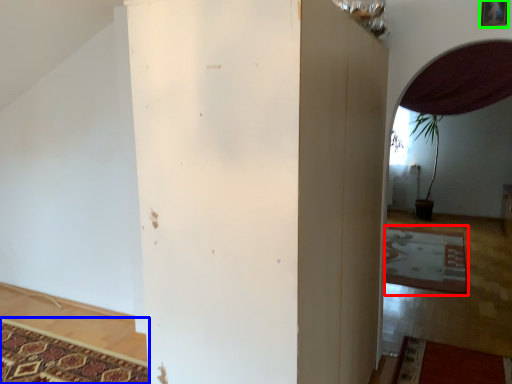
Question: Which object is the closest to the mat (highlighted by a red box)? Choose among these: mat (highlighted by a blue box) or picture frame (highlighted by a green box).

Choices:
 (A) mat
 (B) picture frame

Answer: (B)